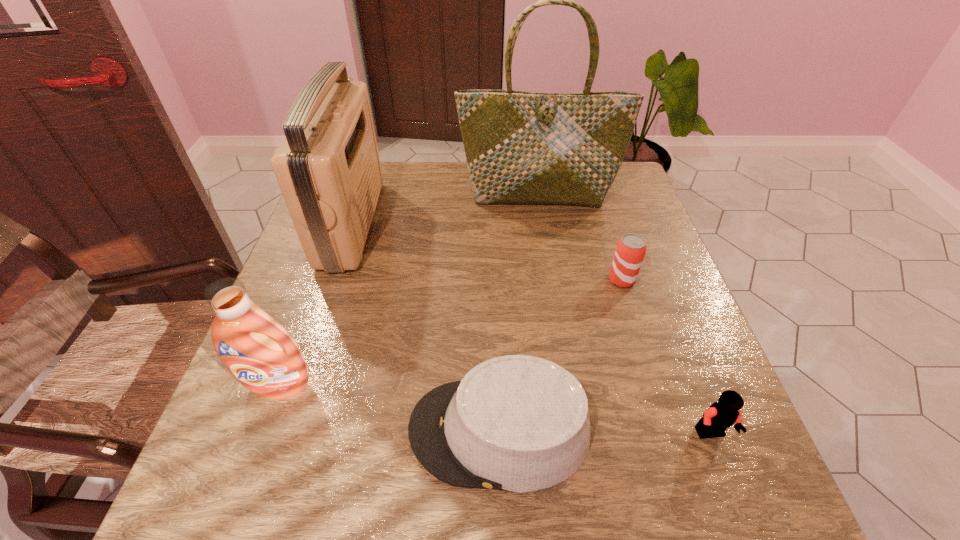
Identify the location of vacant space that is in between the hat and the shopping bag. (518, 313).

What are the coordinates of `free area in between the shopping bag and the beer can` in the screenshot? It's located at (580, 238).

Where is `free area in between the beer can and the hat`? free area in between the beer can and the hat is located at coordinates (561, 355).

At what (x,y) coordinates should I click in order to perform the action: click on free space between the shopping bag and the hat. Please return your answer as a coordinate pair (x, y). The image size is (960, 540). Looking at the image, I should click on (518, 313).

The width and height of the screenshot is (960, 540). I want to click on vacant point located between the radio receiver and the Lego, so click(x=532, y=329).

Where is `unoccupied position between the third tallest object and the shopping bag`? The width and height of the screenshot is (960, 540). unoccupied position between the third tallest object and the shopping bag is located at coordinates (408, 291).

At what (x,y) coordinates should I click in order to perform the action: click on unoccupied position between the third tallest object and the beer can. Please return your answer as a coordinate pair (x, y). Looking at the image, I should click on (450, 333).

Choose which object is the nearest neighbor to the beer can. Please provide its 2D coordinates. Your answer should be formatted as a tuple, i.e. [(x, y)], where the tuple contains the x and y coordinates of a point satisfying the conditions above.

[(521, 147)]

Locate an element on the screen. This screenshot has width=960, height=540. object that ranks as the fourth closest to the hat is located at coordinates (328, 168).

Find the location of `blank area in the image that satisfies the following two spatial constraints: 1. on the front side of the shopping bag; 2. on the front-facing side of the second tallest object`. blank area in the image that satisfies the following two spatial constraints: 1. on the front side of the shopping bag; 2. on the front-facing side of the second tallest object is located at coordinates (541, 224).